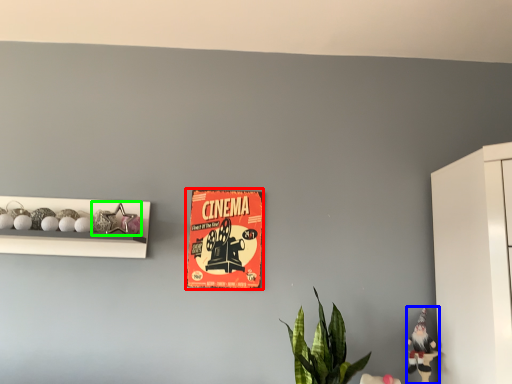
Question: Which object is positioned farthest from postcard (highlighted by a red box)? Select from toy (highlighted by a blue box) and toy (highlighted by a green box).

Choices:
 (A) toy
 (B) toy

Answer: (A)